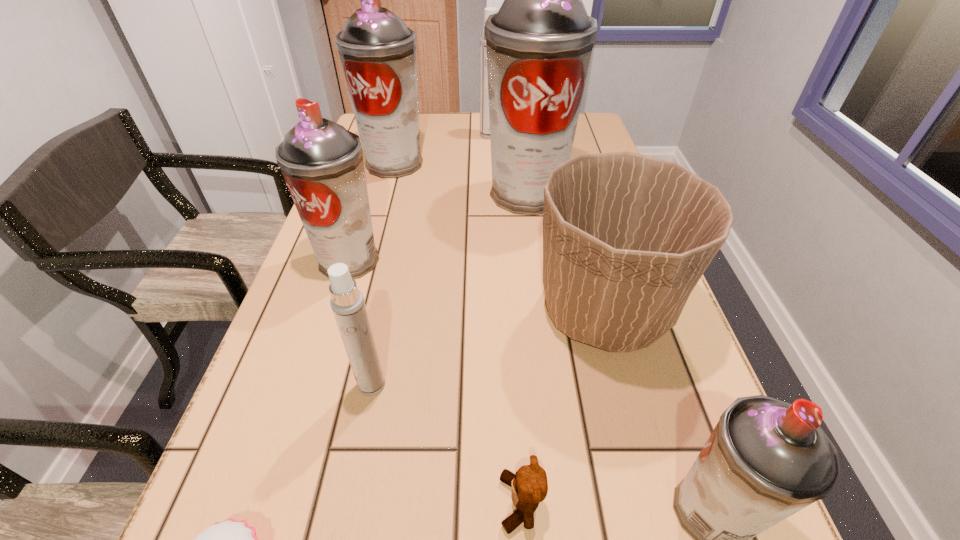
The height and width of the screenshot is (540, 960). Find the location of `the biggest gray aerosol can`. the biggest gray aerosol can is located at coordinates (539, 44).

The image size is (960, 540). What are the coordinates of `the tallest aerosol can` in the screenshot? It's located at (539, 44).

What are the coordinates of `the third smallest gray aerosol can` in the screenshot? It's located at (377, 51).

This screenshot has width=960, height=540. Find the location of `the second tallest aerosol can`. the second tallest aerosol can is located at coordinates (377, 51).

I want to click on the fourth farthest aerosol can, so click(322, 163).

Identify the location of the second smallest gray aerosol can. (322, 163).

Locate an element on the screen. The image size is (960, 540). the farthest aerosol can is located at coordinates (484, 98).

Find the location of a particular element. the bigger white aerosol can is located at coordinates coord(484,98).

Find the location of `flowerpot`. flowerpot is located at coordinates (626, 237).

This screenshot has height=540, width=960. Find the location of `the left white aerosol can`. the left white aerosol can is located at coordinates (347, 303).